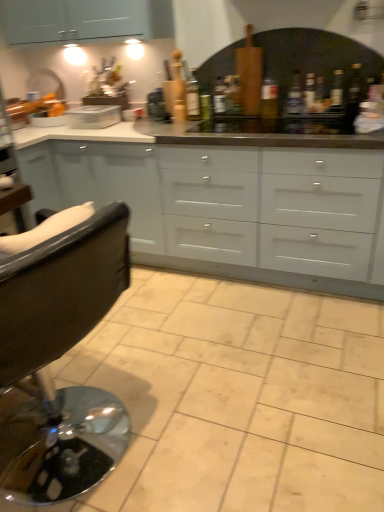
Question: Is green glass bottle at center, placed as the 2th bottle when sorted from left to right, closer to camera compared to beige ceramic tile at center?

Choices:
 (A) yes
 (B) no

Answer: (B)

Question: Can you confirm if green glass bottle at center, placed as the 2th bottle when sorted from left to right, is taller than beige ceramic tile at center?

Choices:
 (A) no
 (B) yes

Answer: (B)

Question: Is green glass bottle at center, arranged as the 5th bottle when viewed from the right, behind beige ceramic tile at center?

Choices:
 (A) no
 (B) yes

Answer: (B)

Question: Can you confirm if green glass bottle at center, placed as the 2th bottle when sorted from left to right, is shorter than beige ceramic tile at center?

Choices:
 (A) yes
 (B) no

Answer: (B)

Question: Could you tell me if green glass bottle at center, arranged as the 5th bottle when viewed from the right, is facing beige ceramic tile at center?

Choices:
 (A) yes
 (B) no

Answer: (B)

Question: Is beige ceramic tile at center in front of or behind white matte cupboard at center in the image?

Choices:
 (A) behind
 (B) front

Answer: (B)

Question: Based on their positions, is beige ceramic tile at center located to the left or right of white matte cupboard at center?

Choices:
 (A) left
 (B) right

Answer: (B)

Question: Is beige ceramic tile at center taller or shorter than white matte cupboard at center?

Choices:
 (A) tall
 (B) short

Answer: (B)

Question: Is point (192, 451) closer or farther from the camera than point (268, 261)?

Choices:
 (A) farther
 (B) closer

Answer: (B)

Question: Would you say black leather chair at left is inside or outside green glass bottle at center, placed as the 6th bottle when sorted from right to left?

Choices:
 (A) inside
 (B) outside

Answer: (B)

Question: From their relative heights in the image, would you say black leather chair at left is taller or shorter than green glass bottle at center, placed as the 6th bottle when sorted from right to left?

Choices:
 (A) tall
 (B) short

Answer: (A)

Question: From the image's perspective, is black leather chair at left positioned above or below green glass bottle at center, the 1th bottle viewed from the left?

Choices:
 (A) above
 (B) below

Answer: (B)

Question: Is point (105, 310) closer or farther from the camera than point (187, 94)?

Choices:
 (A) closer
 (B) farther

Answer: (A)

Question: Choose the correct answer: Is transparent glass bottle at upper right, which ranks as the 1th bottle in right-to-left order, inside translucent glass bottle at upper right, which appears as the 2th bottle when viewed from the right, or outside it?

Choices:
 (A) inside
 (B) outside

Answer: (B)

Question: From the image's perspective, is transparent glass bottle at upper right, the 6th bottle in the left-to-right sequence, located above or below translucent glass bottle at upper right, which is counted as the fifth bottle, starting from the left?

Choices:
 (A) above
 (B) below

Answer: (B)